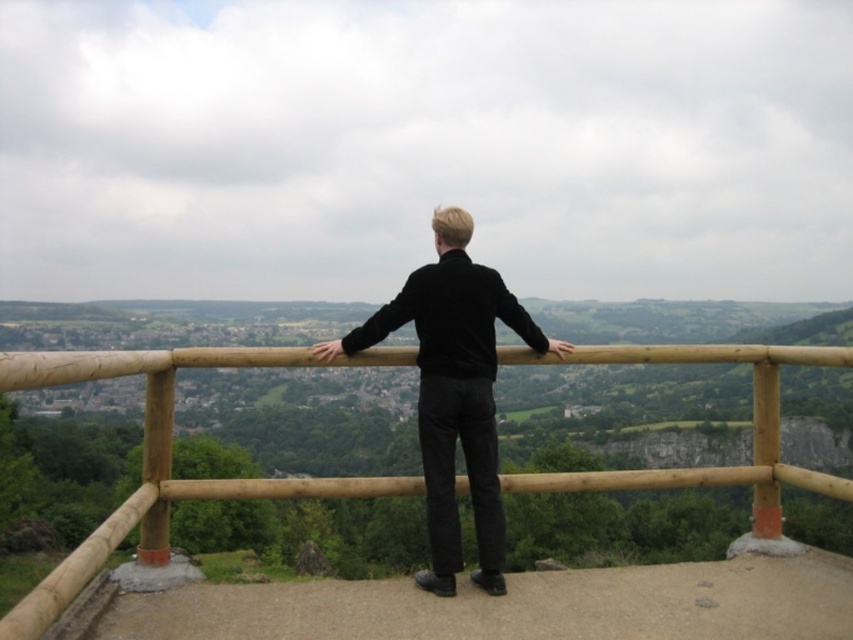
From the picture: You are a photographer trying to capture the person in the image. You notice the brown wooden rail at center and the black velvet sweater at center. Which object should you focus on first to ensure the person is in sharp focus?

The brown wooden rail at center is closer to the viewer than the black velvet sweater at center. To ensure the person is in sharp focus, you should focus on the brown wooden rail at center first, as it is closer and part of the foreground, ensuring depth of field includes both objects.

You are a park ranger checking the safety of the viewing platform. The brown wooden rail at center is represented by point (167, 458). According to the safety guidelines, the rail must be at least 1.2 meters high. Can you determine if the rail meets the height requirement?

The brown wooden rail at center is represented by point (167, 458). The height of the rail cannot be determined from the given information as the coordinates only indicate its position, not its dimensions.